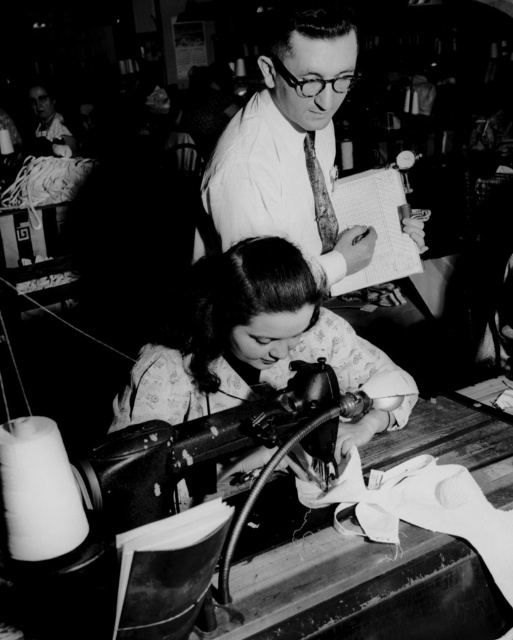
You are an intern in a workshop and need to retrieve the textured wool tie at upper center from the scene. The metallic sewing machine at lower center is blocking your path. Can you move around it to reach the tie?

The metallic sewing machine at lower center is closer to the viewer than the textured wool tie at upper center, so you can move around the sewing machine to access the tie as it is in front of you.